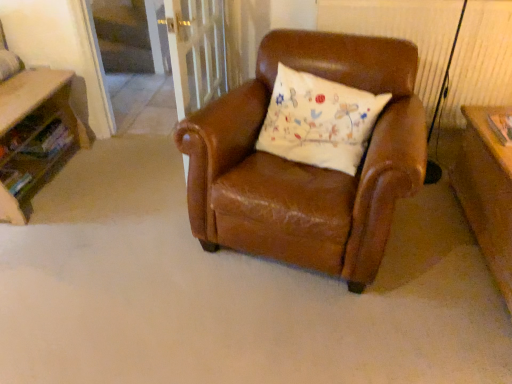
Question: Can you confirm if clear glass screen door at upper center is positioned to the right of white embroidered pillow at center?

Choices:
 (A) yes
 (B) no

Answer: (B)

Question: Is clear glass screen door at upper center positioned behind white embroidered pillow at center?

Choices:
 (A) yes
 (B) no

Answer: (A)

Question: Is clear glass screen door at upper center bigger than white embroidered pillow at center?

Choices:
 (A) no
 (B) yes

Answer: (B)

Question: Is clear glass screen door at upper center positioned beyond the bounds of white embroidered pillow at center?

Choices:
 (A) yes
 (B) no

Answer: (A)

Question: Are clear glass screen door at upper center and white embroidered pillow at center located far from each other?

Choices:
 (A) yes
 (B) no

Answer: (A)

Question: Is white embroidered pillow at center inside the boundaries of clear glass screen door at upper center, or outside?

Choices:
 (A) outside
 (B) inside

Answer: (A)

Question: Looking at the image, does white embroidered pillow at center seem bigger or smaller compared to clear glass screen door at upper center?

Choices:
 (A) small
 (B) big

Answer: (A)

Question: From the image's perspective, is white embroidered pillow at center located above or below clear glass screen door at upper center?

Choices:
 (A) below
 (B) above

Answer: (A)

Question: Is white embroidered pillow at center wider or thinner than clear glass screen door at upper center?

Choices:
 (A) thin
 (B) wide

Answer: (B)

Question: From their relative heights in the image, would you say clear glass screen door at upper center is taller or shorter than wooden table at left?

Choices:
 (A) short
 (B) tall

Answer: (B)

Question: Visually, is clear glass screen door at upper center positioned to the left or to the right of wooden table at left?

Choices:
 (A) right
 (B) left

Answer: (A)

Question: Is point (145, 46) positioned closer to the camera than point (10, 152)?

Choices:
 (A) closer
 (B) farther

Answer: (B)

Question: Is clear glass screen door at upper center spatially inside wooden table at left, or outside of it?

Choices:
 (A) outside
 (B) inside

Answer: (A)

Question: In terms of size, does white embroidered pillow at center appear bigger or smaller than wooden table at left?

Choices:
 (A) small
 (B) big

Answer: (A)

Question: Is white embroidered pillow at center in front of or behind wooden table at left in the image?

Choices:
 (A) front
 (B) behind

Answer: (A)